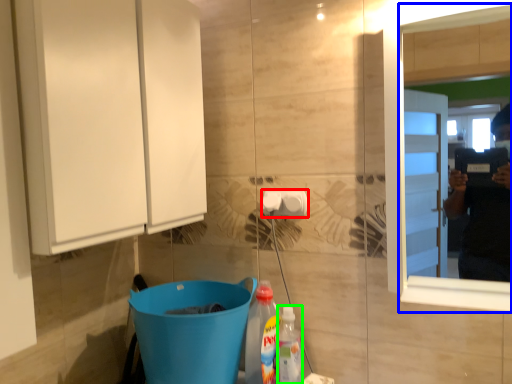
Question: Which object is the farthest from towel bar (highlighted by a red box)? Choose among these: mirror (highlighted by a blue box) or cleaning product (highlighted by a green box).

Choices:
 (A) mirror
 (B) cleaning product

Answer: (A)